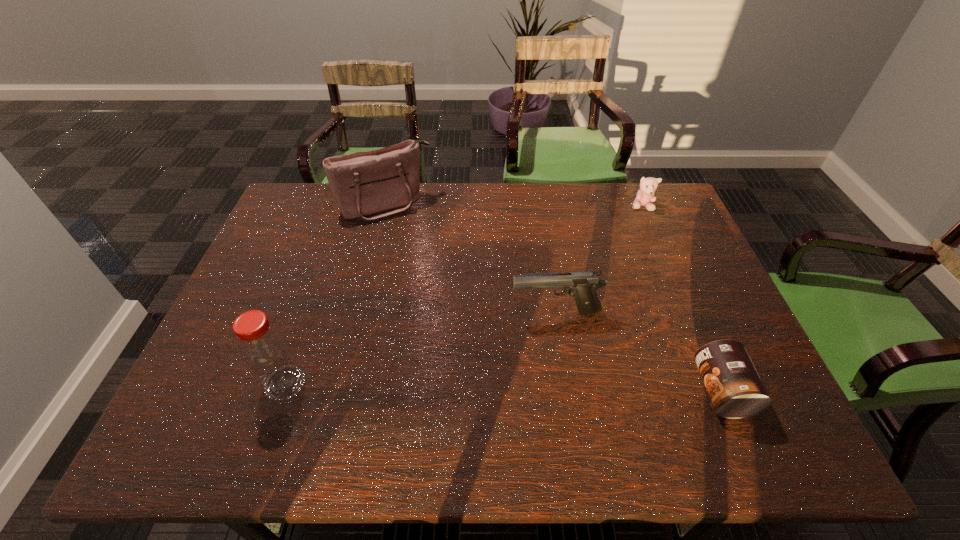
Where is `shoulder bag that is at the far edge`? Image resolution: width=960 pixels, height=540 pixels. shoulder bag that is at the far edge is located at coordinates (368, 185).

Locate an element on the screen. The height and width of the screenshot is (540, 960). bottle situated at the near edge is located at coordinates (266, 352).

Where is `can present at the near edge`? The image size is (960, 540). can present at the near edge is located at coordinates (735, 388).

Where is `object that is at the left edge`? Image resolution: width=960 pixels, height=540 pixels. object that is at the left edge is located at coordinates (266, 352).

Where is `can that is positioned at the right edge`? can that is positioned at the right edge is located at coordinates (735, 388).

Where is `teddy bear that is at the right edge`? The image size is (960, 540). teddy bear that is at the right edge is located at coordinates (646, 196).

The image size is (960, 540). I want to click on object that is at the near left corner, so click(x=266, y=352).

This screenshot has height=540, width=960. I want to click on object located in the far right corner section of the desktop, so click(x=646, y=196).

Locate an element on the screen. object positioned at the near right corner is located at coordinates 735,388.

The width and height of the screenshot is (960, 540). I want to click on free space at the far edge, so click(x=477, y=210).